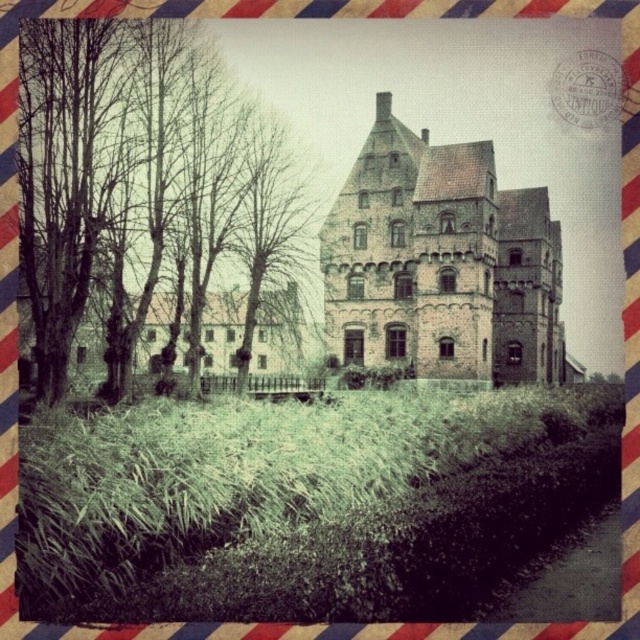
Question: Can you confirm if bare branches at left is bigger than brown stone castle at center?

Choices:
 (A) yes
 (B) no

Answer: (B)

Question: Which of the following is the farthest from the observer?

Choices:
 (A) brown stone castle at center
 (B) bare branches at left

Answer: (A)

Question: Is bare branches at left closer to camera compared to brown stone castle at center?

Choices:
 (A) yes
 (B) no

Answer: (A)

Question: Can you confirm if bare branches at left is positioned below brown stone castle at center?

Choices:
 (A) yes
 (B) no

Answer: (B)

Question: Which point is farther to the camera?

Choices:
 (A) (522, 244)
 (B) (205, 186)

Answer: (A)